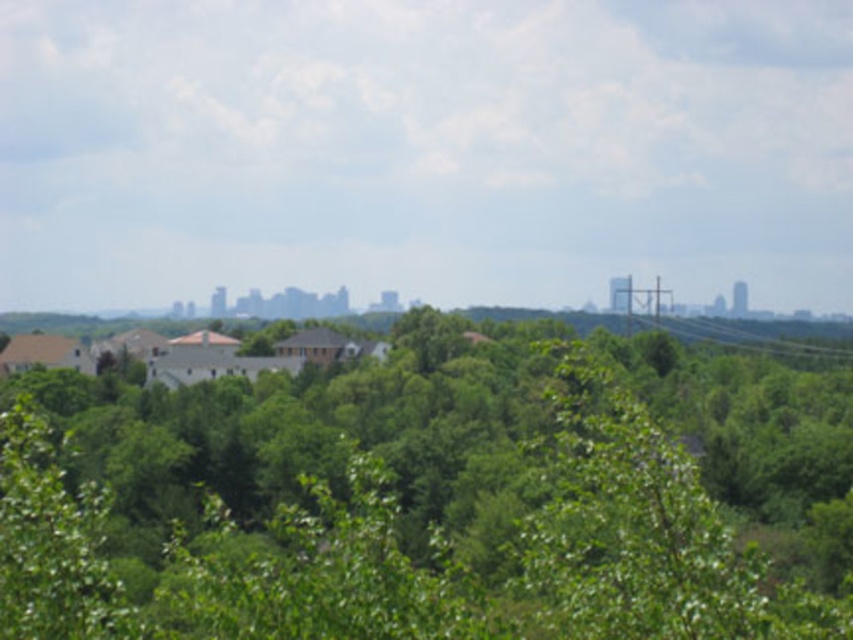
Question: Among these objects, which one is nearest to the camera?

Choices:
 (A) metallic wire at right
 (B) green leafy tree at center

Answer: (B)

Question: Is green leafy tree at center thinner than metallic wire at right?

Choices:
 (A) no
 (B) yes

Answer: (A)

Question: Among these objects, which one is nearest to the camera?

Choices:
 (A) green leafy tree at center
 (B) metallic wire at right

Answer: (A)

Question: Can you confirm if green leafy tree at center is bigger than metallic wire at right?

Choices:
 (A) no
 (B) yes

Answer: (B)

Question: Is green leafy tree at center thinner than metallic wire at right?

Choices:
 (A) no
 (B) yes

Answer: (A)